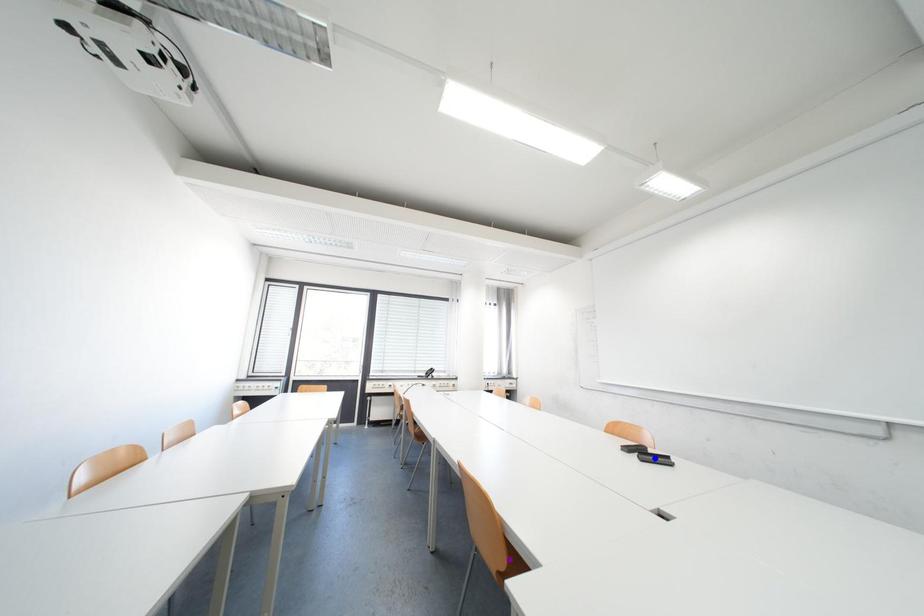
Order these from nearest to farthest:
- orange point
- blue point
- purple point

1. purple point
2. orange point
3. blue point